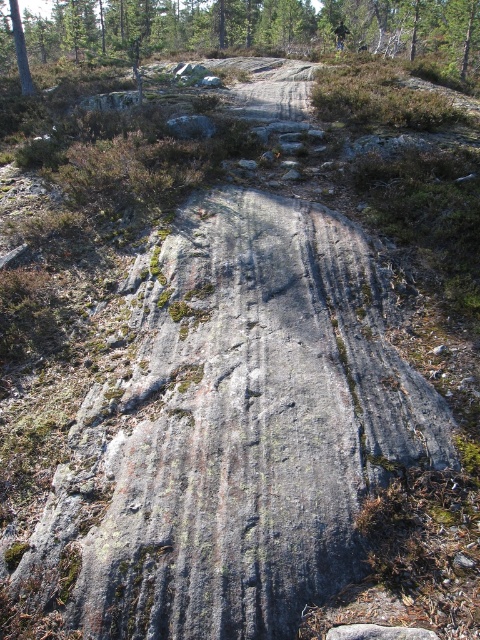
Question: Which point is farther to the camera?

Choices:
 (A) (67, 44)
 (B) (345, 29)
 (C) (23, 72)

Answer: (A)

Question: Which of the following is the farthest from the observer?

Choices:
 (A) green mossy rock at upper center
 (B) smooth bark tree at upper left
 (C) dark green fabric mountain biker at upper center

Answer: (C)

Question: From the image, what is the correct spatial relationship of smooth bark tree at upper left in relation to dark green fabric mountain biker at upper center?

Choices:
 (A) below
 (B) above

Answer: (A)

Question: Among these objects, which one is nearest to the camera?

Choices:
 (A) smooth bark tree at upper left
 (B) dark green fabric mountain biker at upper center
 (C) green mossy rock at upper center

Answer: (C)

Question: Is green mossy rock at upper center wider than dark green fabric mountain biker at upper center?

Choices:
 (A) yes
 (B) no

Answer: (A)

Question: Does smooth bark tree at upper left have a larger size compared to dark green fabric mountain biker at upper center?

Choices:
 (A) no
 (B) yes

Answer: (A)